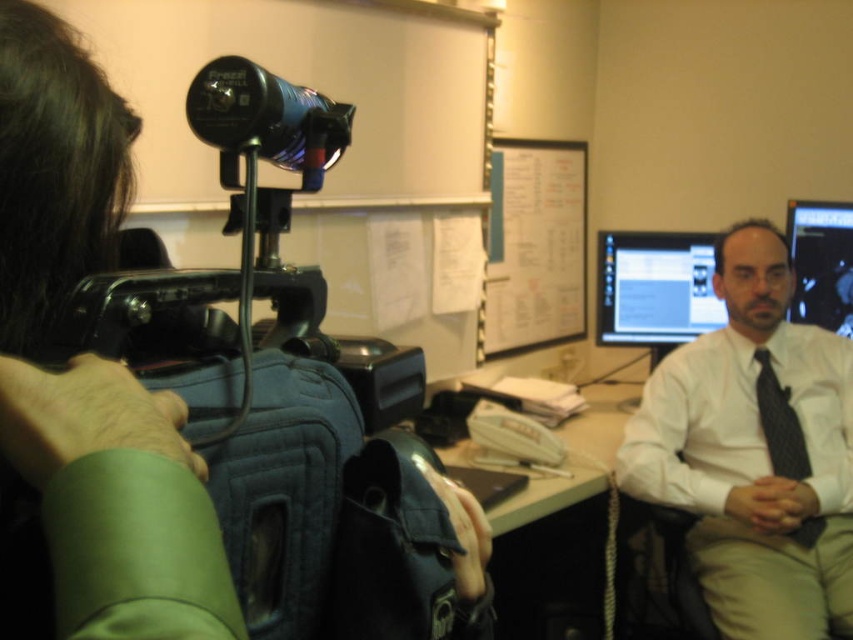
Question: Which point is farther from the camera taking this photo?

Choices:
 (A) pyautogui.click(x=689, y=442)
 (B) pyautogui.click(x=596, y=452)
 (C) pyautogui.click(x=787, y=394)

Answer: (B)

Question: Does white glossy table at center appear under black glossy monitor at upper right?

Choices:
 (A) yes
 (B) no

Answer: (A)

Question: Is white glossy table at center smaller than black glossy monitor at upper right?

Choices:
 (A) yes
 (B) no

Answer: (B)

Question: Where is white shirt at center located in relation to dark gray textured tie at center right in the image?

Choices:
 (A) left
 (B) right

Answer: (A)

Question: Which of the following is the closest to the observer?

Choices:
 (A) (676, 243)
 (B) (498, 515)
 (C) (814, 486)
 (D) (778, 433)

Answer: (B)

Question: Among these objects, which one is nearest to the camera?

Choices:
 (A) matte plastic monitor at center
 (B) black glossy monitor at upper right

Answer: (B)